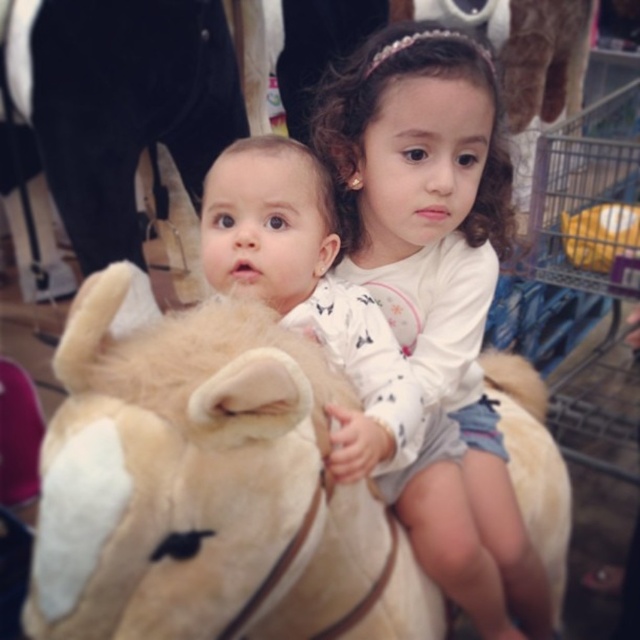
Question: Where is fluffy beige horse at center located in relation to white soft plush at center in the image?

Choices:
 (A) above
 (B) below

Answer: (B)

Question: Which point appears closest to the camera in this image?

Choices:
 (A) (342, 84)
 (B) (218, 417)

Answer: (B)

Question: Can you confirm if fluffy beige horse at center is bigger than white soft plush at center?

Choices:
 (A) no
 (B) yes

Answer: (A)

Question: Can you confirm if fluffy beige horse at center is positioned above white soft plush at center?

Choices:
 (A) no
 (B) yes

Answer: (A)

Question: Which object is farther from the camera taking this photo?

Choices:
 (A) fluffy beige horse at center
 (B) white soft plush at center

Answer: (B)